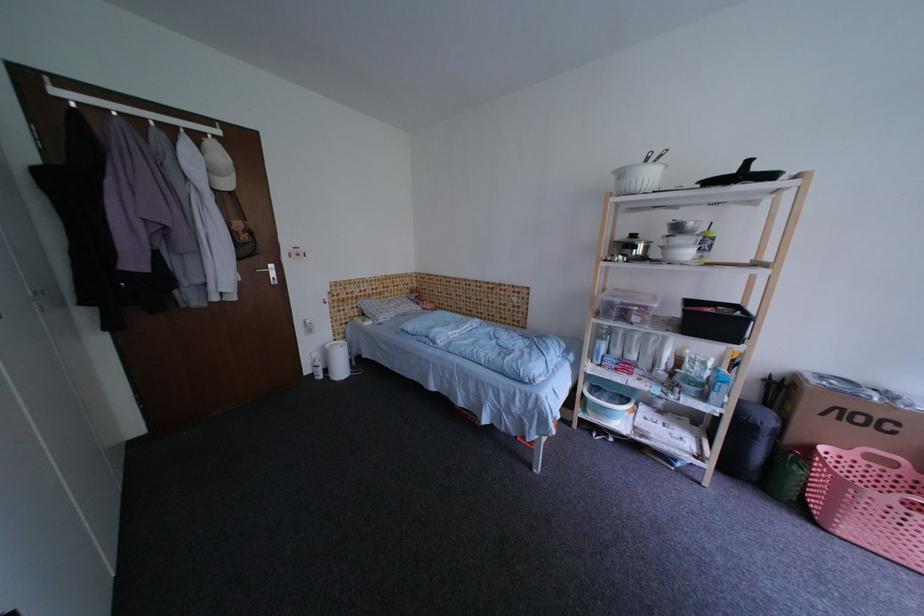
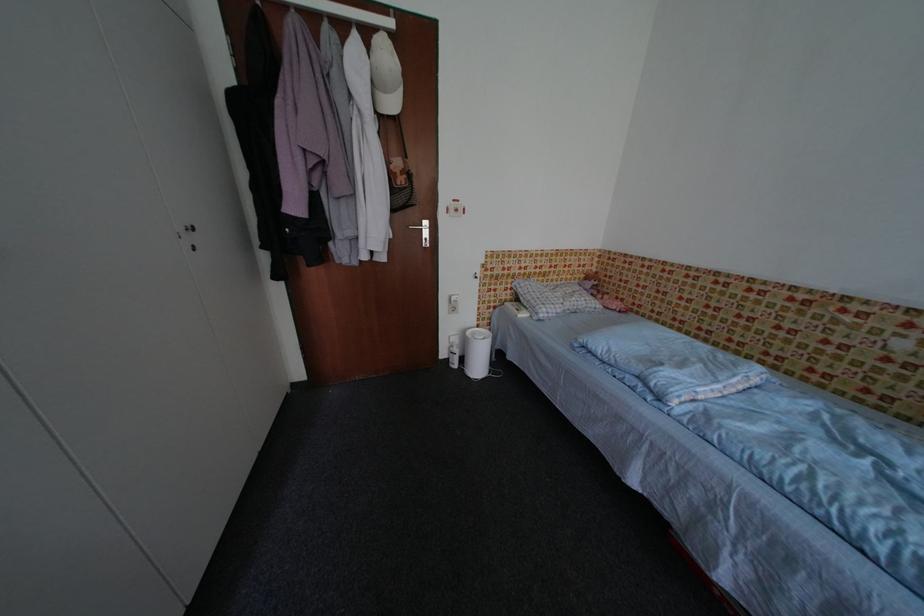
Where in the second image is the point corresponding to point 362,318 from the first image?

(514, 302)